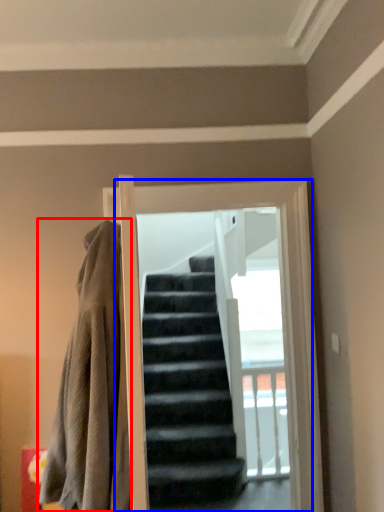
Question: Which object is further to the camera taking this photo, blanket (highlighted by a red box) or screen door (highlighted by a blue box)?

Choices:
 (A) blanket
 (B) screen door

Answer: (B)